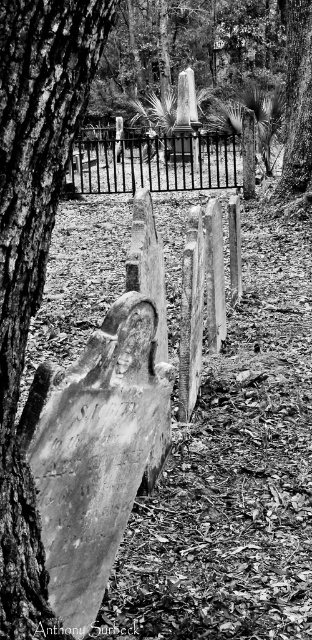
Question: Can you confirm if smooth bark tree trunk at left is bigger than black wrought iron fence at center?

Choices:
 (A) no
 (B) yes

Answer: (A)

Question: In this image, where is smooth bark tree trunk at left located relative to black wrought iron fence at center?

Choices:
 (A) right
 (B) left

Answer: (A)

Question: Which point is closer to the camera taking this photo?

Choices:
 (A) (58, 145)
 (B) (64, 176)

Answer: (A)

Question: Observing the image, what is the correct spatial positioning of smooth bark tree trunk at left in reference to black wrought iron fence at center?

Choices:
 (A) left
 (B) right

Answer: (B)